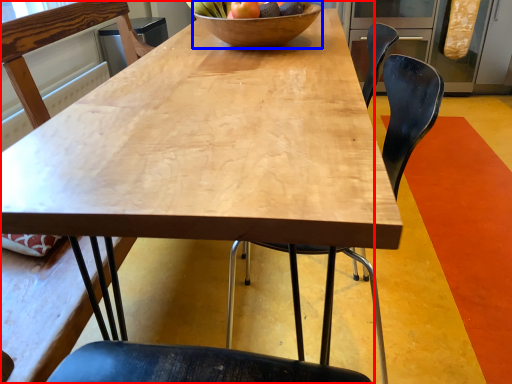
Question: Among these objects, which one is farthest to the camera, chair (highlighted by a red box) or bowl (highlighted by a blue box)?

Choices:
 (A) chair
 (B) bowl

Answer: (B)